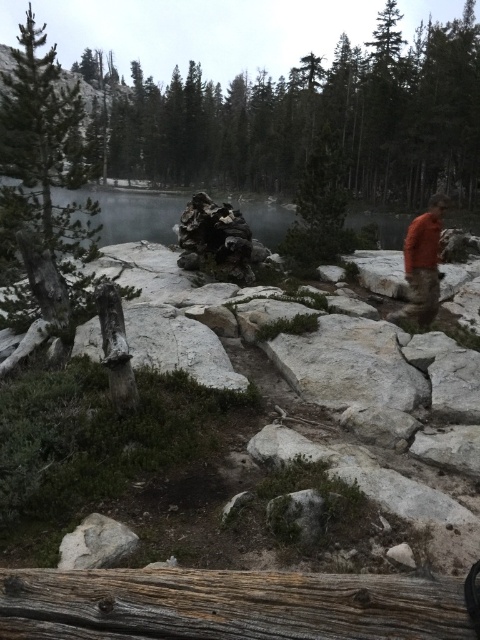
You are an explorer in the scene and want to take a photo of the dark green textured tree at left. Where should you position yourself to capture it in your camera frame?

To capture the dark green textured tree at left in your camera frame, position yourself so that the tree is centered at the coordinates corresponding to the point 0.236 on the horizontal axis and 0.090 on the vertical axis of the image.

Looking at this image, you are planning to take a photo of the dark green textured tree at left and the clear water at lake center from the same viewpoint. Which object will appear taller in your photo?

The dark green textured tree at left will appear taller in the photo since it has a greater height compared to the clear water at lake center according to the description.